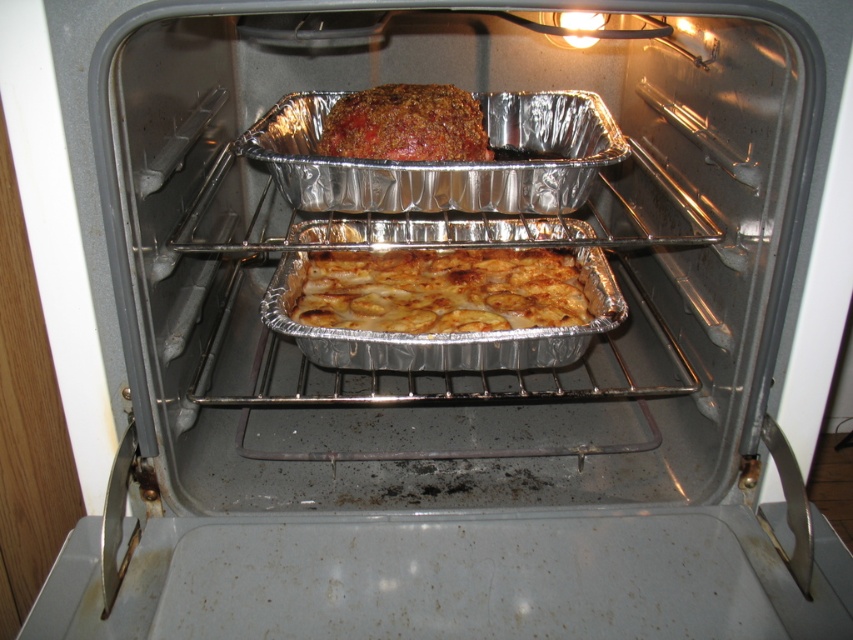
From the picture: Is the position of golden brown aluminum foil at center more distant than that of baked brown meatloaf at center?

Yes, golden brown aluminum foil at center is further from the viewer.

Is golden brown aluminum foil at center smaller than baked brown meatloaf at center?

No, golden brown aluminum foil at center is not smaller than baked brown meatloaf at center.

Measure the distance between point (x=550, y=305) and camera.

3.45 feet

The width and height of the screenshot is (853, 640). Find the location of `golden brown aluminum foil at center`. golden brown aluminum foil at center is located at coordinates (440, 291).